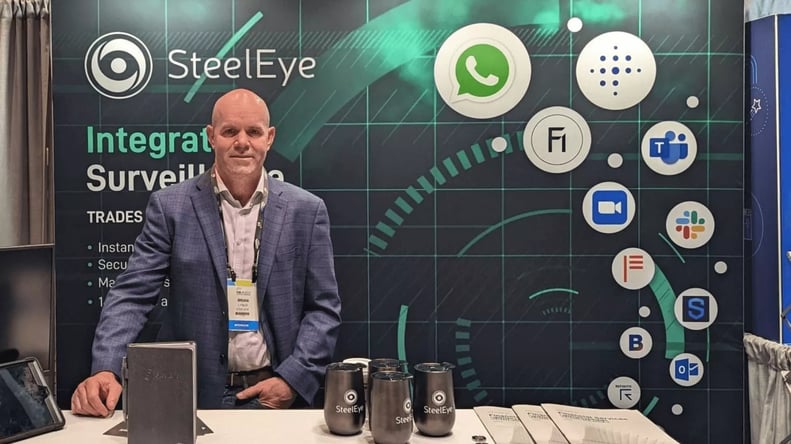
The image size is (791, 444). Find the location of `cups/mugs`. cups/mugs is located at coordinates (x=433, y=389), (x=387, y=365), (x=387, y=398), (x=346, y=398).